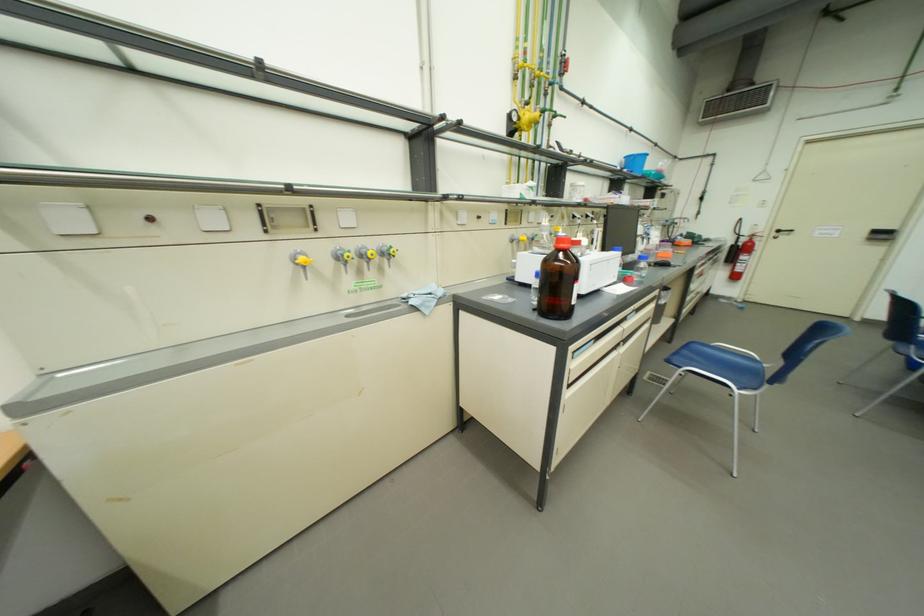
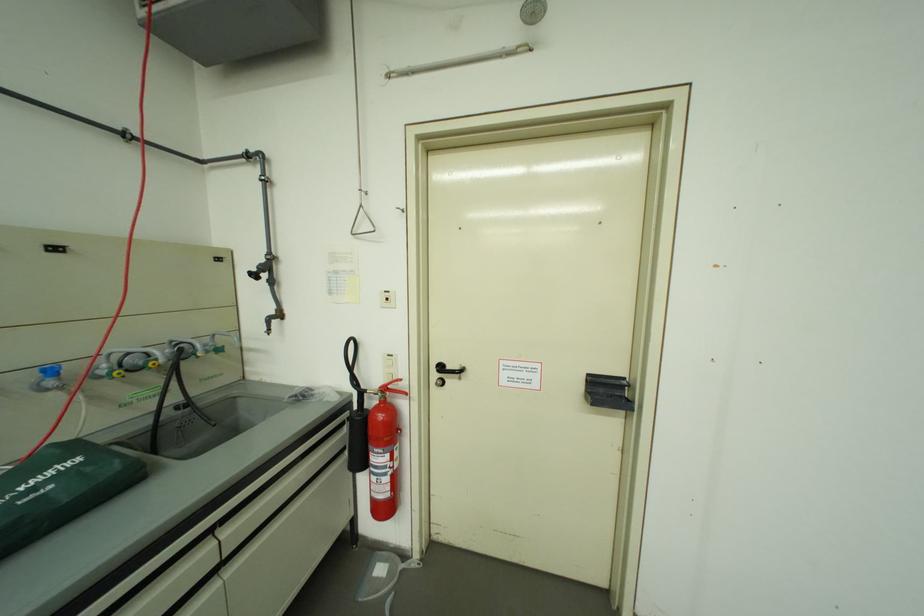
Locate, in the second image, the point that corresponds to [676,223] in the first image.

(62, 373)